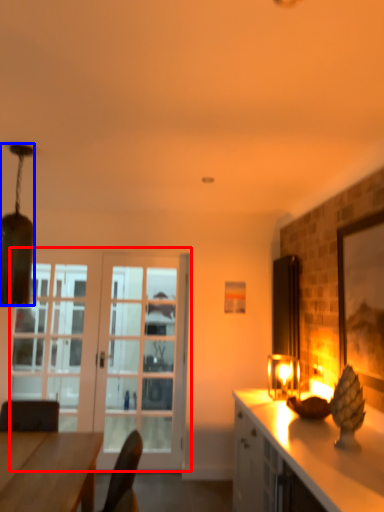
Question: Which object is closer to the camera taking this photo, door (highlighted by a red box) or lamp (highlighted by a blue box)?

Choices:
 (A) door
 (B) lamp

Answer: (B)